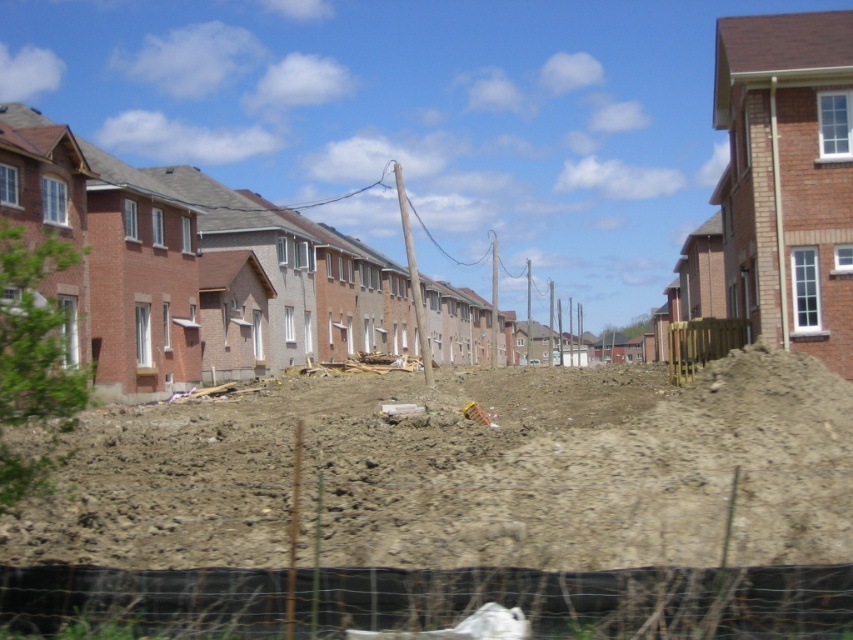
Is brown/dry soil at center bigger than brown wooden fence at center-right?

Correct, brown/dry soil at center is larger in size than brown wooden fence at center-right.

Based on the photo, does brown/dry soil at center appear on the right side of brown wooden fence at center-right?

Incorrect, brown/dry soil at center is not on the right side of brown wooden fence at center-right.

The height and width of the screenshot is (640, 853). Describe the element at coordinates (469, 474) in the screenshot. I see `brown/dry soil at center` at that location.

Where is `brown/dry soil at center`? brown/dry soil at center is located at coordinates (469, 474).

Is brown/dry soil at center positioned at the back of black plastic fence at lower center?

That is True.

Is brown/dry soil at center above black plastic fence at lower center?

Incorrect, brown/dry soil at center is not positioned above black plastic fence at lower center.

Which is in front, point (698, 516) or point (804, 582)?

Positioned in front is point (804, 582).

Find the location of a particular element. The height and width of the screenshot is (640, 853). brown/dry soil at center is located at coordinates (469, 474).

Which of these two, black plastic fence at lower center or brown wooden fence at center-right, stands shorter?

black plastic fence at lower center

Can you confirm if black plastic fence at lower center is taller than brown wooden fence at center-right?

No.

What are the coordinates of `black plastic fence at lower center` in the screenshot? It's located at (439, 596).

Where is `black plastic fence at lower center`? black plastic fence at lower center is located at coordinates (439, 596).